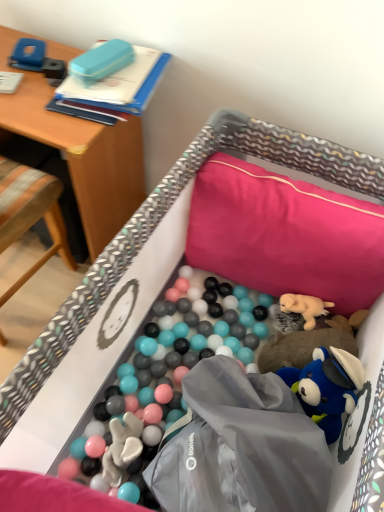
The image size is (384, 512). Describe the element at coordinates (83, 157) in the screenshot. I see `wooden desk at upper left` at that location.

Image resolution: width=384 pixels, height=512 pixels. What do you see at coordinates (304, 307) in the screenshot? I see `soft plush dog at center-right` at bounding box center [304, 307].

Describe the element at coordinates (30, 214) in the screenshot. The height and width of the screenshot is (512, 384). I see `wooden chair at left` at that location.

Measure the distance between point (59, 189) and camera.

Point (59, 189) and camera are 4.87 feet apart.

The width and height of the screenshot is (384, 512). Find the location of `wooden desk at upper left`. wooden desk at upper left is located at coordinates (83, 157).

Could you tell me if wooden desk at upper left is turned towards pink fabric pillow at upper right?

No, wooden desk at upper left is not oriented towards pink fabric pillow at upper right.

Considering the sizes of wooden desk at upper left and pink fabric pillow at upper right in the image, is wooden desk at upper left wider or thinner than pink fabric pillow at upper right?

Considering their sizes, wooden desk at upper left looks slimmer than pink fabric pillow at upper right.

From a real-world perspective, is wooden desk at upper left physically above pink fabric pillow at upper right?

No.

Is wooden desk at upper left further to camera compared to pink fabric pillow at upper right?

Yes, wooden desk at upper left is further from the camera.

Is wooden chair at left situated inside wooden desk at upper left or outside?

wooden chair at left is spatially situated outside wooden desk at upper left.

Based on the photo, how different are the orientations of wooden chair at left and wooden desk at upper left in degrees?

179 degrees separate the facing orientations of wooden chair at left and wooden desk at upper left.

From the image's perspective, which one is positioned higher, wooden chair at left or wooden desk at upper left?

wooden desk at upper left appears higher in the image.

From a real-world perspective, is wooden chair at left located higher than wooden desk at upper left?

Yes.

Is pink fabric pillow at upper right positioned with its back to wooden desk at upper left?

No, wooden desk at upper left is not at the back of pink fabric pillow at upper right.

From a real-world perspective, between pink fabric pillow at upper right and wooden desk at upper left, who is vertically higher?

pink fabric pillow at upper right, from a real-world perspective.

Can you confirm if pink fabric pillow at upper right is taller than wooden desk at upper left?

No.

Does pink fabric pillow at upper right have a greater width compared to wooden desk at upper left?

Indeed, pink fabric pillow at upper right has a greater width compared to wooden desk at upper left.

Does point (339, 293) come closer to viewer compared to point (3, 218)?

That is True.

This screenshot has width=384, height=512. I want to click on pillow below the wooden chair at left (from the image's perspective), so click(x=285, y=234).

Consider the image. Considering the sizes of objects pink fabric pillow at upper right and wooden chair at left in the image provided, who is wider, pink fabric pillow at upper right or wooden chair at left?

With larger width is pink fabric pillow at upper right.

Looking at this image, is pink fabric pillow at upper right facing towards wooden chair at left?

No, pink fabric pillow at upper right is not turned towards wooden chair at left.

In the scene shown: From a real-world perspective, is soft plush dog at center-right over wooden chair at left?

No, from a real-world perspective, soft plush dog at center-right is not above wooden chair at left.

Is soft plush dog at center-right placed right next to wooden chair at left?

They are not placed beside each other.

Does soft plush dog at center-right have a larger size compared to wooden chair at left?

Actually, soft plush dog at center-right might be smaller than wooden chair at left.

Does point (289, 310) appear closer or farther from the camera than point (56, 203)?

Point (289, 310) appears to be closer to the viewer than point (56, 203).

Measure the distance between soft plush dog at center-right and pink fabric pillow at upper right.

The distance of soft plush dog at center-right from pink fabric pillow at upper right is 8.64 inches.

Is soft plush dog at center-right at the right side of pink fabric pillow at upper right?

Indeed, soft plush dog at center-right is positioned on the right side of pink fabric pillow at upper right.

Which is behind, soft plush dog at center-right or pink fabric pillow at upper right?

soft plush dog at center-right is further away from the camera.

Based on the photo, from a real-world perspective, is soft plush dog at center-right physically below pink fabric pillow at upper right?

Yes, from a real-world perspective, soft plush dog at center-right is beneath pink fabric pillow at upper right.

From a real-world perspective, is pink fabric pillow at upper right located beneath soft plush dog at center-right?

Actually, pink fabric pillow at upper right is physically above soft plush dog at center-right in the real world.

Which of these two, pink fabric pillow at upper right or soft plush dog at center-right, stands taller?

pink fabric pillow at upper right is taller.

Does pink fabric pillow at upper right contain soft plush dog at center-right?

No, soft plush dog at center-right is not surrounded by pink fabric pillow at upper right.

From the image's perspective, does pink fabric pillow at upper right appear higher than soft plush dog at center-right?

Indeed, from the image's perspective, pink fabric pillow at upper right is shown above soft plush dog at center-right.

What are the coordinates of `desk behind the pink fabric pillow at upper right` in the screenshot? It's located at (83, 157).

At what (x,y) coordinates should I click in order to perform the action: click on desk that is on the right side of wooden chair at left. Please return your answer as a coordinate pair (x, y). This screenshot has height=512, width=384. Looking at the image, I should click on (83, 157).

From the picture: From the image, which object appears to be nearer to wooden chair at left, wooden desk at upper left or soft plush dog at center-right?

wooden desk at upper left is positioned closer to the anchor wooden chair at left.

Estimate the real-world distances between objects in this image. Which object is further from wooden chair at left, soft plush dog at center-right or wooden desk at upper left?

soft plush dog at center-right lies further to wooden chair at left than the other object.

From the image, which object appears to be farther from pink fabric pillow at upper right, soft plush dog at center-right or wooden chair at left?

wooden chair at left is further to pink fabric pillow at upper right.

Which object lies nearer to the anchor point soft plush dog at center-right, wooden chair at left or wooden desk at upper left?

Based on the image, wooden desk at upper left appears to be nearer to soft plush dog at center-right.

Considering their positions, is wooden chair at left positioned closer to pink fabric pillow at upper right than soft plush dog at center-right?

soft plush dog at center-right.

Based on the photo, which object lies nearer to the anchor point pink fabric pillow at upper right, wooden desk at upper left or wooden chair at left?

wooden desk at upper left.

From the image, which object appears to be nearer to pink fabric pillow at upper right, soft plush dog at center-right or wooden desk at upper left?

The object closer to pink fabric pillow at upper right is soft plush dog at center-right.

Considering their positions, is wooden desk at upper left positioned further to soft plush dog at center-right than pink fabric pillow at upper right?

Based on the image, wooden desk at upper left appears to be further to soft plush dog at center-right.

Locate an element on the screen. desk situated between wooden chair at left and soft plush dog at center-right from left to right is located at coordinates (83, 157).

You are a GUI agent. You are given a task and a screenshot of the screen. Output one action in this format:
    pyautogui.click(x=<x>, y=<y>)
    Task: Click on the desk between wooden chair at left and pink fabric pillow at upper right
    The image size is (384, 512).
    Given the screenshot: What is the action you would take?
    pyautogui.click(x=83, y=157)

What are the coordinates of `pillow situated between wooden chair at left and soft plush dog at center-right from left to right` in the screenshot? It's located at 285,234.

This screenshot has height=512, width=384. Identify the location of pillow between wooden desk at upper left and soft plush dog at center-right. (285, 234).